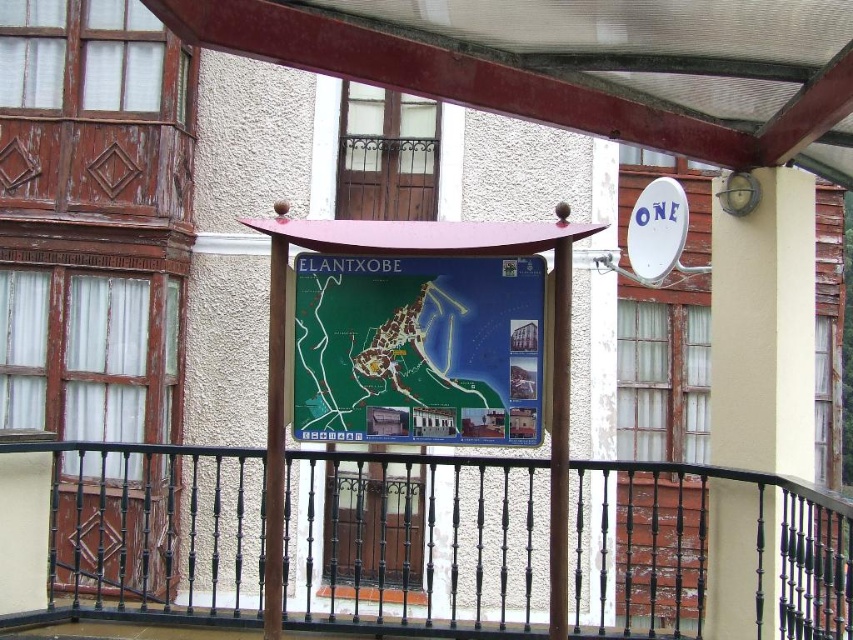
Question: Which object is farther from the camera taking this photo?

Choices:
 (A) white painted concrete pillar at upper right
 (B) wooden map at center

Answer: (A)

Question: Is wooden map at center positioned behind wooden pole at center?

Choices:
 (A) no
 (B) yes

Answer: (A)

Question: Observing the image, what is the correct spatial positioning of metallic red awning at upper center in reference to wooden pole at center?

Choices:
 (A) left
 (B) right

Answer: (B)

Question: Is green map at center behind wooden pole at center?

Choices:
 (A) yes
 (B) no

Answer: (A)

Question: Among these points, which one is farthest from the camera?

Choices:
 (A) (759, 397)
 (B) (550, 513)

Answer: (A)

Question: Which point is closer to the camera?

Choices:
 (A) (563, 424)
 (B) (283, 326)
 (C) (554, 266)
 (D) (408, 332)

Answer: (A)